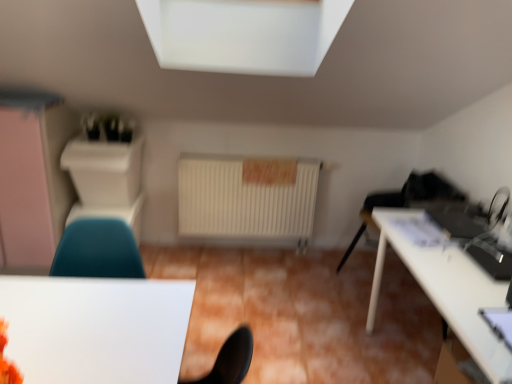
You are a GUI agent. You are given a task and a screenshot of the screen. Output one action in this format:
    pyautogui.click(x=<x>, y=<y>)
    Task: Click on the vacant space to the right of teal fabric chair at lower left
    
    Given the screenshot: What is the action you would take?
    pyautogui.click(x=173, y=262)